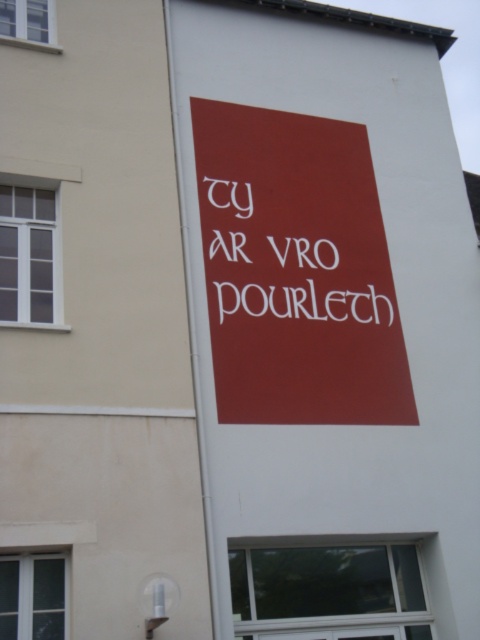
You are a delivery person trying to read both the matte red sign at center and the white matte sign at center on a building. The space between them is narrow. Can you comfortably read both signs without moving your head?

The distance between the matte red sign at center and the white matte sign at center is 12.00 inches, so yes, you can comfortably read both signs without moving your head as the space between them allows for clear visibility.

In the scene shown: You are standing in front of a building and see both the matte red sign at center and the white matte sign at center. Which sign is located below the other?

The matte red sign at center is positioned under the white matte sign at center, so the red one is below the white one.